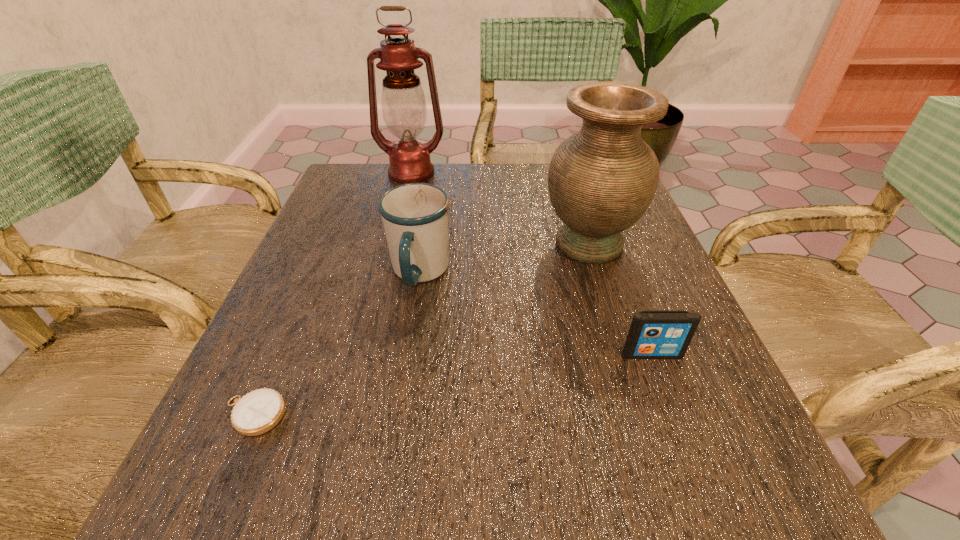
Identify the location of free space located on the handle side of the mug. (379, 528).

Image resolution: width=960 pixels, height=540 pixels. In order to click on vacant space located 0.050m on the front screen of the second nearest object in this screenshot , I will do `click(663, 386)`.

Where is `blank space located 0.190m on the back of the nearest object`? blank space located 0.190m on the back of the nearest object is located at coordinates (301, 303).

Identify the location of object present at the far edge. pyautogui.click(x=404, y=108).

Identify the location of oil lamp that is at the left edge. (404, 108).

This screenshot has width=960, height=540. In order to click on compass that is at the left edge in this screenshot , I will do 257,412.

Where is `vase present at the right edge`? Image resolution: width=960 pixels, height=540 pixels. vase present at the right edge is located at coordinates (601, 180).

You are a GUI agent. You are given a task and a screenshot of the screen. Output one action in this format:
    pyautogui.click(x=<x>, y=<y>)
    Task: Click on the iPod that is at the right edge
    The image size is (960, 540).
    Given the screenshot: What is the action you would take?
    pyautogui.click(x=653, y=334)

The image size is (960, 540). I want to click on object that is positioned at the far left corner, so click(x=404, y=108).

I want to click on free region at the far edge of the desktop, so click(461, 202).